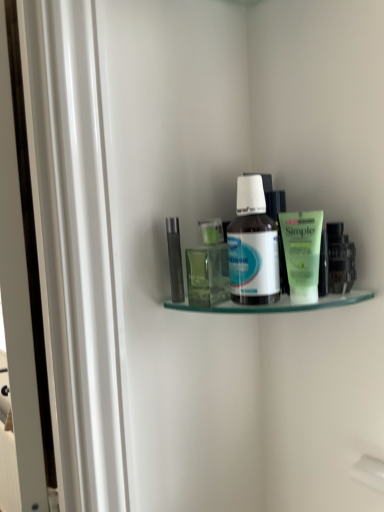
Question: Would you say clear glass shelf at upper center is outside green matte tube at right, the 4th toiletry positioned from the left?

Choices:
 (A) no
 (B) yes

Answer: (B)

Question: Would you consider clear glass shelf at upper center to be distant from green matte tube at right, which ranks as the first toiletry in right-to-left order?

Choices:
 (A) no
 (B) yes

Answer: (A)

Question: Is clear glass shelf at upper center positioned in front of green matte tube at right, the 4th toiletry positioned from the left?

Choices:
 (A) yes
 (B) no

Answer: (A)

Question: Is clear glass shelf at upper center oriented away from green matte tube at right, the 4th toiletry positioned from the left?

Choices:
 (A) no
 (B) yes

Answer: (A)

Question: From a real-world perspective, is clear glass shelf at upper center under green matte tube at right, the 4th toiletry positioned from the left?

Choices:
 (A) yes
 (B) no

Answer: (A)

Question: From the image's perspective, is green matte tube at right, the 4th toiletry positioned from the left, above or below clear glass shelf at upper center?

Choices:
 (A) below
 (B) above

Answer: (B)

Question: Considering their positions, is green matte tube at right, which ranks as the first toiletry in right-to-left order, located in front of or behind clear glass shelf at upper center?

Choices:
 (A) front
 (B) behind

Answer: (B)

Question: Considering the positions of green matte tube at right, which ranks as the first toiletry in right-to-left order, and clear glass shelf at upper center in the image, is green matte tube at right, which ranks as the first toiletry in right-to-left order, wider or thinner than clear glass shelf at upper center?

Choices:
 (A) wide
 (B) thin

Answer: (B)

Question: Visually, is green matte tube at right, which ranks as the first toiletry in right-to-left order, positioned to the left or to the right of clear glass shelf at upper center?

Choices:
 (A) right
 (B) left

Answer: (A)

Question: Relative to green matte tube at upper right, marked as the 3th toiletry in a left-to-right arrangement, is green matte tube at right, which ranks as the first toiletry in right-to-left order, in front or behind?

Choices:
 (A) front
 (B) behind

Answer: (B)

Question: From their relative heights in the image, would you say green matte tube at right, which ranks as the first toiletry in right-to-left order, is taller or shorter than green matte tube at upper right, which is the second toiletry in right-to-left order?

Choices:
 (A) short
 (B) tall

Answer: (A)

Question: Would you say green matte tube at right, the 4th toiletry positioned from the left, is to the left or to the right of green matte tube at upper right, marked as the 3th toiletry in a left-to-right arrangement, in the picture?

Choices:
 (A) right
 (B) left

Answer: (A)

Question: From the image's perspective, is green matte tube at right, the 4th toiletry positioned from the left, located above or below green matte tube at upper right, which is the second toiletry in right-to-left order?

Choices:
 (A) above
 (B) below

Answer: (B)

Question: Considering their positions, is translucent plastic bottle at center, the 2th toiletry from the left, located in front of or behind white glossy bottle at center?

Choices:
 (A) front
 (B) behind

Answer: (B)

Question: Is translucent plastic bottle at center, the 2th toiletry from the left, spatially inside white glossy bottle at center, or outside of it?

Choices:
 (A) inside
 (B) outside

Answer: (B)